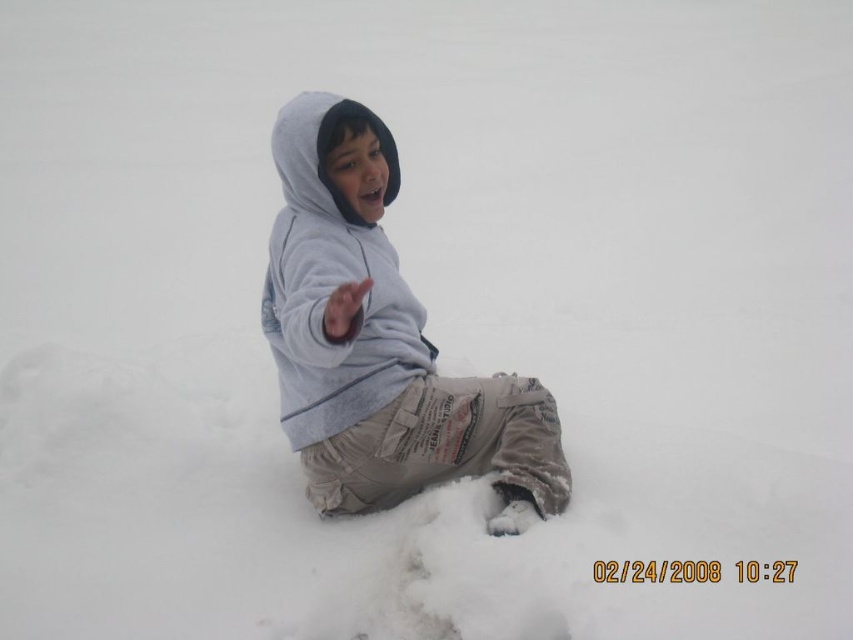
Does matte gray hoodie at center have a larger size compared to gray fleece sweatshirt at center?

Indeed, matte gray hoodie at center has a larger size compared to gray fleece sweatshirt at center.

Which is more to the left, matte gray hoodie at center or gray fleece sweatshirt at center?

Positioned to the left is matte gray hoodie at center.

This screenshot has height=640, width=853. What are the coordinates of `matte gray hoodie at center` in the screenshot? It's located at (379, 340).

Find the location of a particular element. Image resolution: width=853 pixels, height=640 pixels. matte gray hoodie at center is located at coordinates (379, 340).